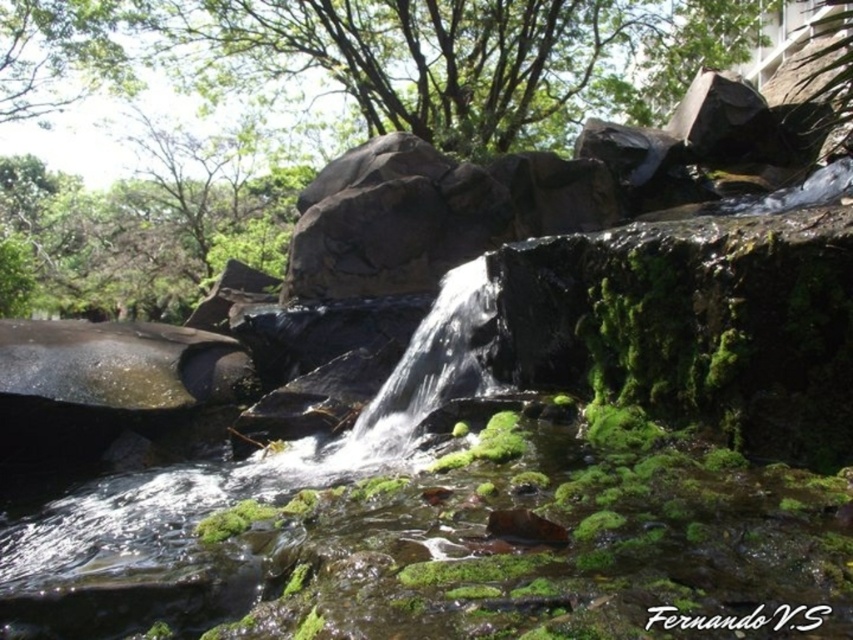
You are a hiker who wants to take a photo of the clear water at center without the green leafy tree at upper center blocking the view. Can you move to a position where the tree is out of the frame?

The green leafy tree at upper center is larger in size than clear water at center, so moving to a position where the tree is out of the frame might be difficult due to its size. However, adjusting your angle or moving further away could help reduce its presence in the photo.

You are standing at the bottom right corner of the image and want to walk towards the green leafy tree at upper center. Which direction should you move in?

The green leafy tree at upper center is located at point (387, 54), so you should move towards the upper center direction from the bottom right corner to reach it.

You are a hiker who wants to cross from the green leafy tree at upper center to the clear water at center. The bridge you plan to use can only support a gap of up to 15 feet. Is the bridge sufficient?

The distance between the green leafy tree at upper center and the clear water at center is 18.07 feet, which exceeds the bridge capacity of 15 feet. Therefore, the bridge is not sufficient.